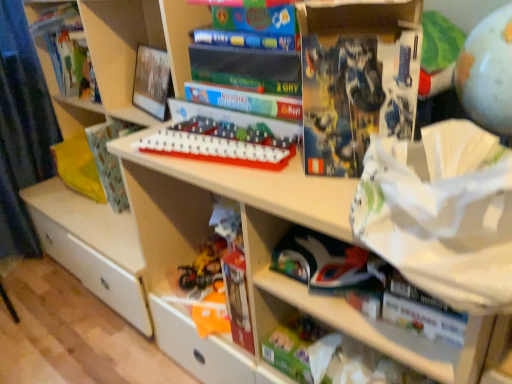
Identify the location of shiny plastic toys at lower center, the first toy in the back-to-front sequence. This screenshot has height=384, width=512. (203, 264).

At what (x,y) coordinates should I click in order to perform the action: click on hardcover book at upper left. Please return your answer as a coordinate pair (x, y). The image size is (512, 384). Looking at the image, I should click on [x=67, y=50].

What do you see at coordinates (487, 72) in the screenshot? I see `matte gray globe at upper right, marked as the fourth toy in a left-to-right arrangement` at bounding box center [487, 72].

The image size is (512, 384). Find the location of `patterned paper at left, the 1th paperback book positioned from the back`. patterned paper at left, the 1th paperback book positioned from the back is located at coordinates (108, 162).

Describe the element at coordinates (221, 144) in the screenshot. I see `white plastic game board at center, marked as the second toy in a left-to-right arrangement` at that location.

Image resolution: width=512 pixels, height=384 pixels. In order to click on blue matte book at upper center, which appears as the second paperback book when viewed from the back in this screenshot , I will do `click(357, 78)`.

Find the location of a particular element. The image size is (512, 384). shiny plastic toys at lower center, the third toy viewed from the top is located at coordinates (203, 264).

Is hardcover book at upper left not near white plastic game board at center, the third toy when ordered from bottom to top?

They are positioned close to each other.

Considering the points (44, 8) and (204, 155), which point is in front, point (44, 8) or point (204, 155)?

Point (204, 155)

Considering the sizes of objects hardcover book at upper left and white plastic game board at center, the 3th toy positioned from the back, in the image provided, who is smaller, hardcover book at upper left or white plastic game board at center, the 3th toy positioned from the back,?

Smaller between the two is white plastic game board at center, the 3th toy positioned from the back.

From a real-world perspective, is hardcover book at upper left above or below white plastic game board at center, which appears as the 2th toy when viewed from the top?

hardcover book at upper left is above white plastic game board at center, which appears as the 2th toy when viewed from the top.

Is shiny plastic toys at lower center, the first toy in the back-to-front sequence, surrounded by white plastic game board at center, which appears as the 2th toy when viewed from the top?

No, shiny plastic toys at lower center, the first toy in the back-to-front sequence, is not inside white plastic game board at center, which appears as the 2th toy when viewed from the top.

From the image's perspective, is white plastic game board at center, marked as the second toy in a left-to-right arrangement, positioned above or below shiny plastic toys at lower center, placed as the 2th toy when sorted from bottom to top?

Clearly, from the image's perspective, white plastic game board at center, marked as the second toy in a left-to-right arrangement, is above shiny plastic toys at lower center, placed as the 2th toy when sorted from bottom to top.

Considering the positions of objects white plastic game board at center, the third toy when ordered from bottom to top, and shiny plastic toys at lower center, placed as the 2th toy when sorted from bottom to top, in the image provided, who is behind, white plastic game board at center, the third toy when ordered from bottom to top, or shiny plastic toys at lower center, placed as the 2th toy when sorted from bottom to top,?

shiny plastic toys at lower center, placed as the 2th toy when sorted from bottom to top, is behind.

Considering the sizes of objects white plastic game board at center, the third toy when ordered from bottom to top, and shiny plastic toys at lower center, the third toy viewed from the top, in the image provided, who is taller, white plastic game board at center, the third toy when ordered from bottom to top, or shiny plastic toys at lower center, the third toy viewed from the top,?

With more height is shiny plastic toys at lower center, the third toy viewed from the top.

Can we say matte gray globe at upper right, arranged as the fourth toy when viewed from the back, lies outside white plastic game board at center, the second toy in the front-to-back sequence?

Indeed, matte gray globe at upper right, arranged as the fourth toy when viewed from the back, is completely outside white plastic game board at center, the second toy in the front-to-back sequence.

Can you tell me how much matte gray globe at upper right, positioned as the 1th toy in top-to-bottom order, and white plastic game board at center, the second toy in the front-to-back sequence, differ in facing direction?

The angular difference between matte gray globe at upper right, positioned as the 1th toy in top-to-bottom order, and white plastic game board at center, the second toy in the front-to-back sequence, is 11.4 degrees.

From their relative heights in the image, would you say matte gray globe at upper right, arranged as the fourth toy when viewed from the back, is taller or shorter than white plastic game board at center, the third toy when ordered from bottom to top?

Clearly, matte gray globe at upper right, arranged as the fourth toy when viewed from the back, is taller compared to white plastic game board at center, the third toy when ordered from bottom to top.

Is point (494, 114) in front of point (163, 141)?

Yes, it is in front of point (163, 141).

Which is more to the right, shiny plastic toys at lower center, the 4th toy from the front, or white plastic game board at center, which appears as the 2th toy when viewed from the top?

white plastic game board at center, which appears as the 2th toy when viewed from the top, is more to the right.

Is shiny plastic toys at lower center, the 4th toy from the front, surrounding white plastic game board at center, marked as the second toy in a left-to-right arrangement?

Actually, white plastic game board at center, marked as the second toy in a left-to-right arrangement, is outside shiny plastic toys at lower center, the 4th toy from the front.

What's the angular difference between shiny plastic toys at lower center, placed as the 2th toy when sorted from bottom to top, and white plastic game board at center, marked as the 3th toy in a right-to-left arrangement,'s facing directions?

The angular difference between shiny plastic toys at lower center, placed as the 2th toy when sorted from bottom to top, and white plastic game board at center, marked as the 3th toy in a right-to-left arrangement, is 17.4 degrees.

From the picture: In the image, is shiny plastic toys at lower center, the first toy in the back-to-front sequence, positioned in front of or behind white plastic game board at center, marked as the 3th toy in a right-to-left arrangement?

In the image, shiny plastic toys at lower center, the first toy in the back-to-front sequence, appears behind white plastic game board at center, marked as the 3th toy in a right-to-left arrangement.

From a real-world perspective, is shiny plastic toys at lower center, the first toy in the back-to-front sequence, physically located above or below patterned paper at left, which is the 2th paperback book from front to back?

In terms of real-world spatial position, shiny plastic toys at lower center, the first toy in the back-to-front sequence, is below patterned paper at left, which is the 2th paperback book from front to back.

Is shiny plastic toys at lower center, the 4th toy from the front, facing away from patterned paper at left, which is the 2th paperback book from front to back?

No, shiny plastic toys at lower center, the 4th toy from the front, is not facing away from patterned paper at left, which is the 2th paperback book from front to back.

Is shiny plastic toys at lower center, the first toy in the back-to-front sequence, outside of patterned paper at left, the 1th paperback book positioned from the left?

Yes, shiny plastic toys at lower center, the first toy in the back-to-front sequence, is outside of patterned paper at left, the 1th paperback book positioned from the left.

Can you confirm if matte gray globe at upper right, marked as the fourth toy in a left-to-right arrangement, is thinner than green matte toy at lower center, the 3th toy in the left-to-right sequence?

No.

From their relative heights in the image, would you say matte gray globe at upper right, the first toy in the right-to-left sequence, is taller or shorter than green matte toy at lower center, placed as the 3th toy when sorted from front to back?

matte gray globe at upper right, the first toy in the right-to-left sequence, is taller than green matte toy at lower center, placed as the 3th toy when sorted from front to back.

Is green matte toy at lower center, placed as the 4th toy when sorted from top to bottom, at the back of matte gray globe at upper right, positioned as the 1th toy in top-to-bottom order?

matte gray globe at upper right, positioned as the 1th toy in top-to-bottom order, is not turned away from green matte toy at lower center, placed as the 4th toy when sorted from top to bottom.

From a real-world perspective, is matte gray globe at upper right, acting as the first toy starting from the front, physically located above or below green matte toy at lower center, placed as the 4th toy when sorted from top to bottom?

Clearly, from a real-world perspective, matte gray globe at upper right, acting as the first toy starting from the front, is above green matte toy at lower center, placed as the 4th toy when sorted from top to bottom.

Looking at their sizes, would you say patterned paper at left, marked as the 2th paperback book in a right-to-left arrangement, is wider or thinner than matte gray globe at upper right, arranged as the fourth toy when viewed from the back?

patterned paper at left, marked as the 2th paperback book in a right-to-left arrangement, is wider than matte gray globe at upper right, arranged as the fourth toy when viewed from the back.

Looking at this image, could matte gray globe at upper right, the first toy in the right-to-left sequence, be considered to be inside patterned paper at left, marked as the 2th paperback book in a right-to-left arrangement?

No.

Which of these two, patterned paper at left, the 1th paperback book positioned from the left, or matte gray globe at upper right, positioned as the 1th toy in top-to-bottom order, is smaller?

Smaller between the two is patterned paper at left, the 1th paperback book positioned from the left.

Is patterned paper at left, the 1th paperback book positioned from the left, not close to matte gray globe at upper right, the first toy in the right-to-left sequence?

Yes, patterned paper at left, the 1th paperback book positioned from the left, is far from matte gray globe at upper right, the first toy in the right-to-left sequence.

From the image's perspective, count 2nd toys downward from the hardcover book at upper left and point to it. Please provide its 2D coordinates.

[(221, 144)]

Which toy is the 1st one when counting from the right side of the shiny plastic toys at lower center, the first toy in the left-to-right sequence? Please provide its 2D coordinates.

[(221, 144)]

Estimate the real-world distances between objects in this image. Which object is closer to blue matte book at upper center, which ranks as the first paperback book in right-to-left order, green matte toy at lower center, acting as the second toy starting from the back, or matte gray globe at upper right, the first toy in the right-to-left sequence?

matte gray globe at upper right, the first toy in the right-to-left sequence, is closer to blue matte book at upper center, which ranks as the first paperback book in right-to-left order.

Based on their spatial positions, is matte gray globe at upper right, which is the 4th toy in bottom-to-top order, or green matte toy at lower center, the second toy viewed from the right, further from patterned paper at left, the 1th paperback book positioned from the left?

Based on the image, matte gray globe at upper right, which is the 4th toy in bottom-to-top order, appears to be further to patterned paper at left, the 1th paperback book positioned from the left.

Consider the image. When comparing their distances from hardcover book at upper left, does white plastic game board at center, the second toy in the front-to-back sequence, or patterned paper at left, the 1th paperback book positioned from the left, seem closer?

patterned paper at left, the 1th paperback book positioned from the left, is closer to hardcover book at upper left.

Looking at the image, which one is located further to blue matte book at upper center, which ranks as the first paperback book in right-to-left order, white plastic game board at center, the third toy when ordered from bottom to top, or shiny plastic toys at lower center, the 4th toy from the front?

The object further to blue matte book at upper center, which ranks as the first paperback book in right-to-left order, is shiny plastic toys at lower center, the 4th toy from the front.

When comparing their distances from blue matte book at upper center, the 2th paperback book when ordered from left to right, does white plastic game board at center, the second toy in the front-to-back sequence, or green matte toy at lower center, acting as the second toy starting from the back, seem further?

green matte toy at lower center, acting as the second toy starting from the back, lies further to blue matte book at upper center, the 2th paperback book when ordered from left to right, than the other object.

Estimate the real-world distances between objects in this image. Which object is further from hardcover book at upper left, white plastic game board at center, the second toy in the front-to-back sequence, or green matte toy at lower center, acting as the first toy starting from the bottom?

green matte toy at lower center, acting as the first toy starting from the bottom, is further to hardcover book at upper left.

Consider the image. Based on their spatial positions, is shiny plastic toys at lower center, placed as the 2th toy when sorted from bottom to top, or green matte toy at lower center, the 3th toy in the left-to-right sequence, closer to hardcover book at upper left?

Among the two, shiny plastic toys at lower center, placed as the 2th toy when sorted from bottom to top, is located nearer to hardcover book at upper left.

Considering their positions, is green matte toy at lower center, acting as the second toy starting from the back, positioned closer to shiny plastic toys at lower center, placed as the 2th toy when sorted from bottom to top, than white plastic game board at center, the third toy when ordered from bottom to top?

white plastic game board at center, the third toy when ordered from bottom to top, is positioned closer to the anchor shiny plastic toys at lower center, placed as the 2th toy when sorted from bottom to top.

Find the location of a particular element. Image resolution: width=512 pixels, height=384 pixels. paperback book between matte gray globe at upper right, positioned as the 1th toy in top-to-bottom order, and patterned paper at left, which is the 2th paperback book from front to back, along the z-axis is located at coordinates (357, 78).

Identify the location of paperback book between white plastic game board at center, the third toy when ordered from bottom to top, and matte gray globe at upper right, which is the 4th toy in bottom-to-top order, from left to right. (357, 78).

Find the location of a particular element. This screenshot has width=512, height=384. toy between white plastic game board at center, marked as the second toy in a left-to-right arrangement, and green matte toy at lower center, acting as the second toy starting from the back, in the vertical direction is located at coordinates (203, 264).

Where is `paperback book located between hardcover book at upper left and green matte toy at lower center, acting as the first toy starting from the bottom, in the left-right direction`? paperback book located between hardcover book at upper left and green matte toy at lower center, acting as the first toy starting from the bottom, in the left-right direction is located at coordinates (108, 162).